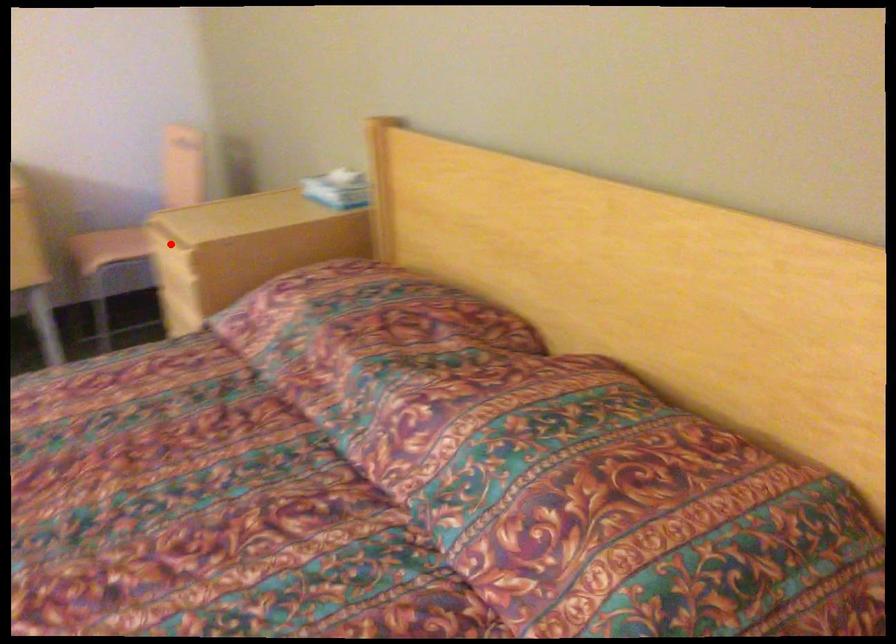
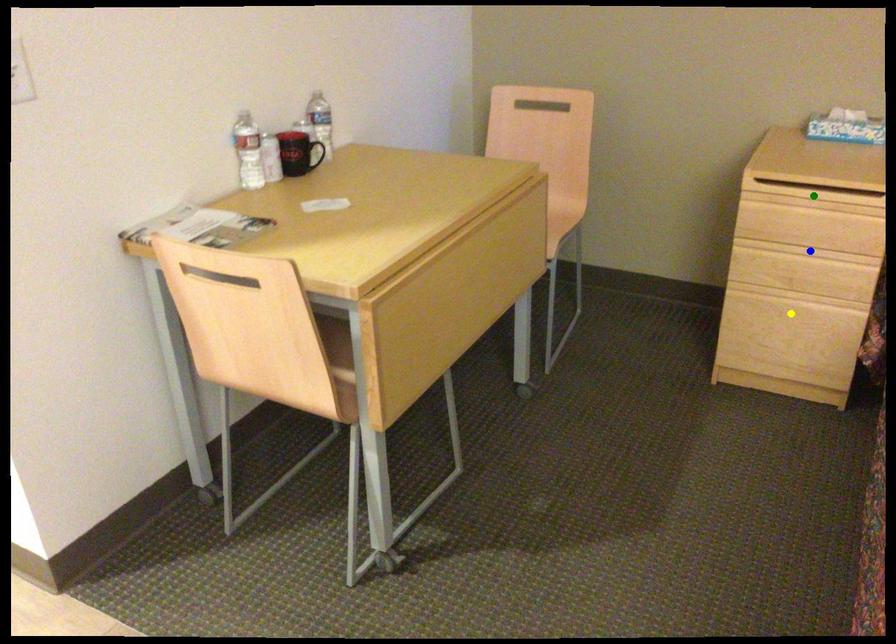
Question: I am providing you with two images of the same scene from different viewpoints. A red point is marked on the first image. You are given multiple points on the second image. Which spot in image 2 lines up with the point in image 1?

Choices:
 (A) blue point
 (B) green point
 (C) yellow point

Answer: (B)